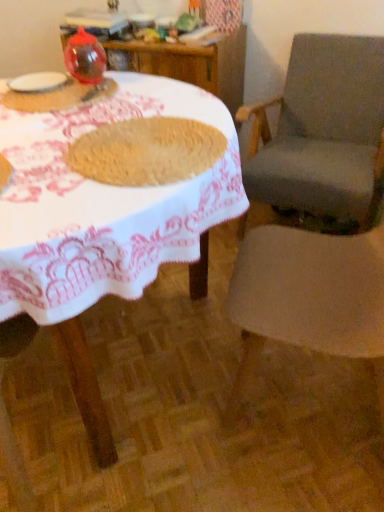
Locate an element on the screen. Image resolution: width=384 pixels, height=512 pixels. vacant space that's between white matte plate at upper left, marked as the 2th tableware in a bottom-to-top arrangement, and brown woven mat at center is located at coordinates (81, 113).